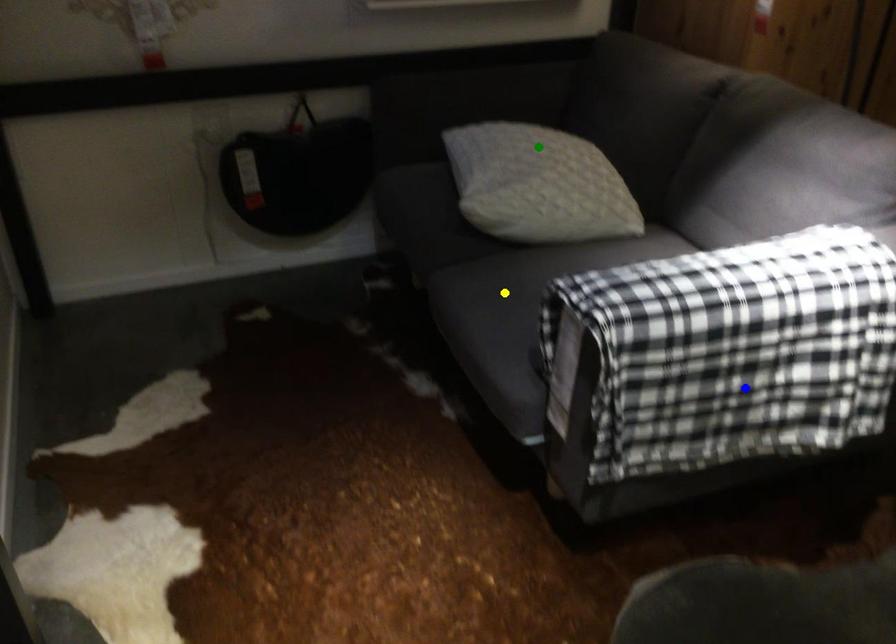
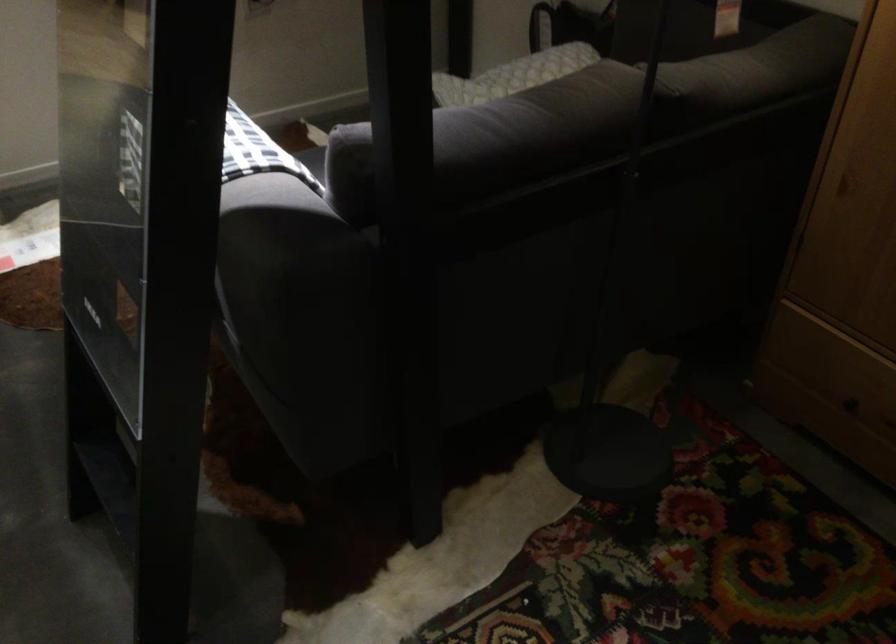
I am providing you with two images of the same scene from different viewpoints. Three points are marked in image1. Which point corresponds to a part or object that is occluded in image2?In image1, three points are marked. Which of them correspond to a part or object that is occluded in image2?Among the three points shown in image1, which one corresponds to a part or object that is no longer visible due to occlusion in image2?

Invisible in image2: yellow point, blue point.